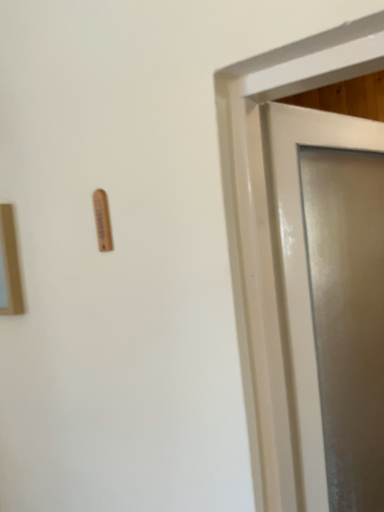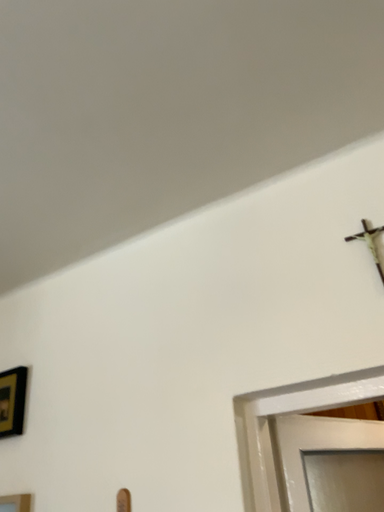
Question: Which way did the camera rotate in the video?

Choices:
 (A) rotated downward
 (B) rotated upward

Answer: (B)